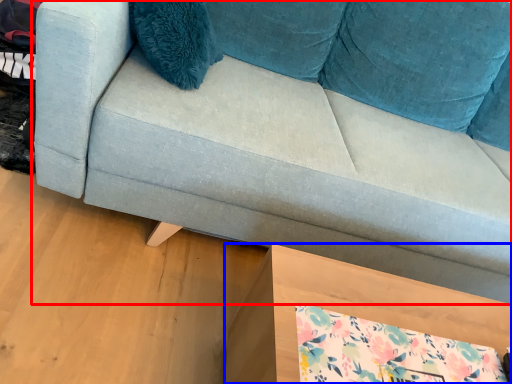
Question: Which point is closer to the camera, studio couch (highlighted by a red box) or table (highlighted by a blue box)?

Choices:
 (A) studio couch
 (B) table

Answer: (A)